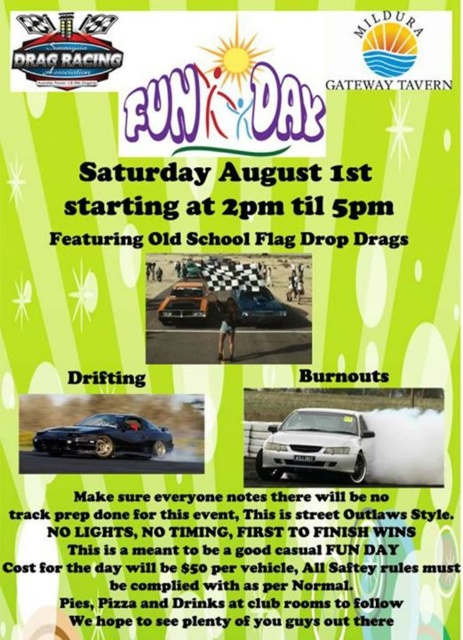
Question: Is checkered fabric race track at center wider than shiny blue car at center?

Choices:
 (A) no
 (B) yes

Answer: (B)

Question: Which object is positioned farthest from the white matte sedan at center?

Choices:
 (A) shiny blue car at center
 (B) orange matte car at center
 (C) shiny black car at center
 (D) checkered fabric race track at center

Answer: (B)

Question: Is shiny black car at center smaller than shiny blue car at center?

Choices:
 (A) yes
 (B) no

Answer: (B)

Question: Which point is farther from the camera taking this photo?

Choices:
 (A) (263, 300)
 (B) (168, 323)
 (C) (283, 451)

Answer: (A)

Question: Is checkered fabric race track at center closer to camera compared to shiny black car at center?

Choices:
 (A) yes
 (B) no

Answer: (B)

Question: Among these points, which one is farthest from the camera?

Choices:
 (A) (249, 310)
 (B) (194, 340)

Answer: (A)